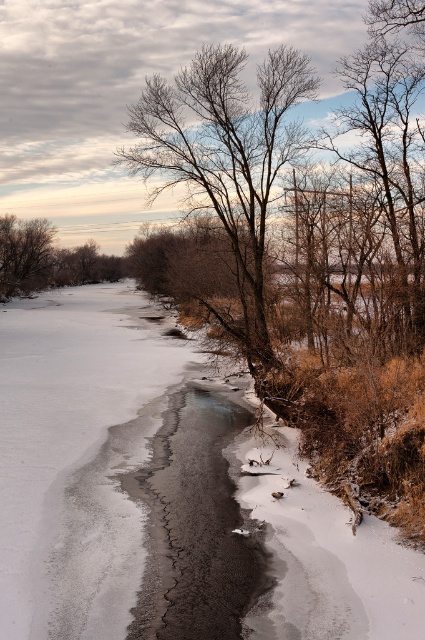
Question: Among these objects, which one is farthest from the camera?

Choices:
 (A) brown matte tree at left
 (B) bare branches at center

Answer: (A)

Question: Does bare branches at center have a smaller size compared to brown matte tree at left?

Choices:
 (A) yes
 (B) no

Answer: (B)

Question: Which point is closer to the camera taking this photo?

Choices:
 (A) (204, 157)
 (B) (34, 240)

Answer: (A)

Question: Does bare branches at center have a smaller size compared to brown matte tree at left?

Choices:
 (A) no
 (B) yes

Answer: (A)

Question: Which point is farther from the camera taking this photo?

Choices:
 (A) (6, 230)
 (B) (150, 156)

Answer: (A)

Question: Where is bare branches at center located in relation to brown matte tree at left in the image?

Choices:
 (A) above
 (B) below

Answer: (B)